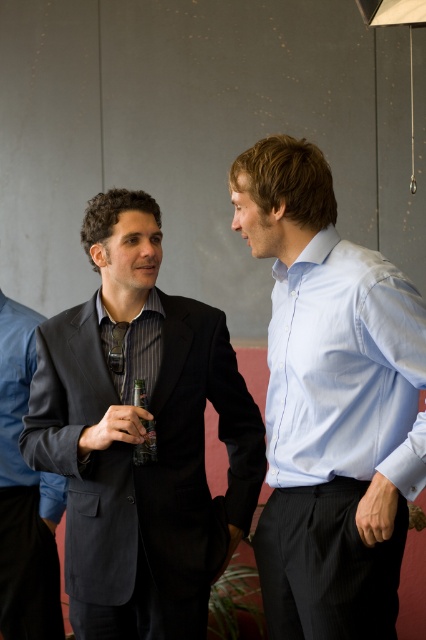
Question: Does matte black suit at left come in front of black glass bottle at center?

Choices:
 (A) no
 (B) yes

Answer: (A)

Question: Which point is closer to the camera taking this photo?

Choices:
 (A) (114, 218)
 (B) (123, 356)

Answer: (A)

Question: Can you confirm if black glass bottle at center is smaller than black silk tie at center?

Choices:
 (A) no
 (B) yes

Answer: (A)

Question: Which object is closer to the camera taking this photo?

Choices:
 (A) black glass bottle at center
 (B) matte black suit at left
 (C) light blue shirt at center
 (D) black silk tie at center

Answer: (C)

Question: Which point is farther to the camera?

Choices:
 (A) light blue shirt at center
 (B) dark gray suit at left

Answer: (B)

Question: From the image, what is the correct spatial relationship of light blue shirt at center in relation to matte black suit at left?

Choices:
 (A) left
 (B) right

Answer: (B)